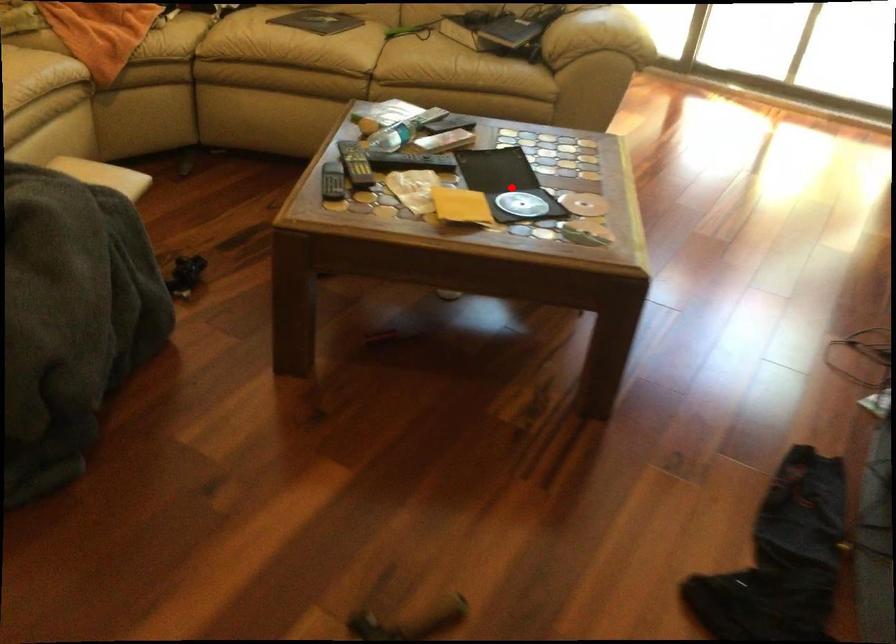
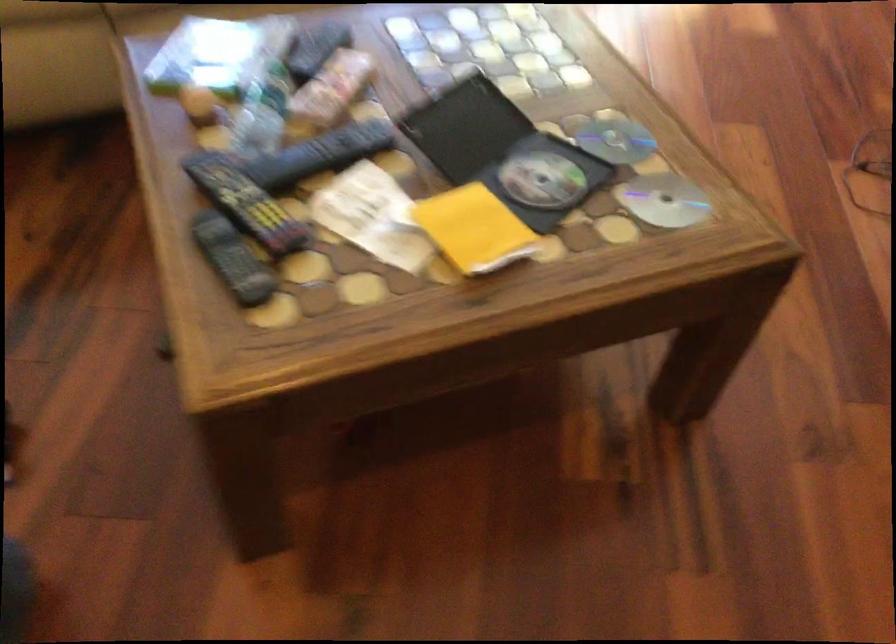
Question: I am providing you with two images of the same scene from different viewpoints. A red point is shown in image1. For the corresponding object point in image2, is it positioned nearer or farther from the camera?

Choices:
 (A) Nearer
 (B) Farther

Answer: (A)